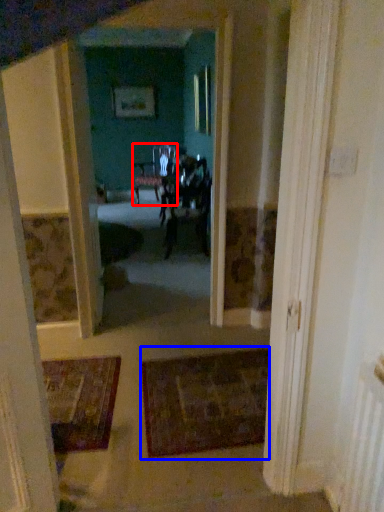
Question: Which point is closer to the camera, chair (highlighted by a red box) or doormat (highlighted by a blue box)?

Choices:
 (A) chair
 (B) doormat

Answer: (B)